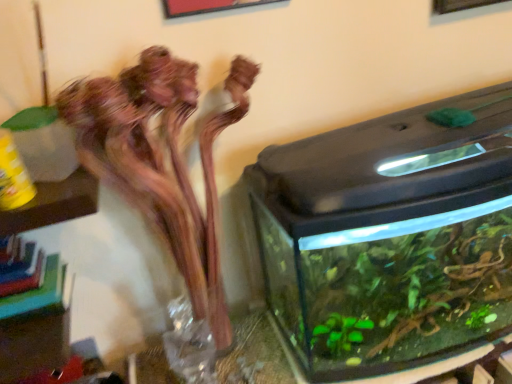
Question: Does point (507, 112) appear closer or farther from the camera than point (154, 57)?

Choices:
 (A) farther
 (B) closer

Answer: (A)

Question: Is transparent glass water tank at right situated inside translucent glass vase at left or outside?

Choices:
 (A) inside
 (B) outside

Answer: (B)

Question: Which object is the closest to the transparent glass vase at center?

Choices:
 (A) transparent glass water tank at right
 (B) translucent glass vase at left
 (C) translucent glass vase at center

Answer: (B)

Question: Estimate the real-world distances between objects in this image. Which object is farther from the transparent glass vase at center?

Choices:
 (A) transparent glass water tank at right
 (B) translucent glass vase at left
 (C) translucent glass vase at center

Answer: (A)